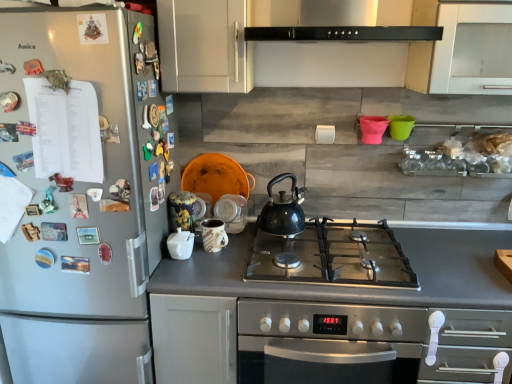
Question: Can you confirm if matte ceramic mug at center, which is counted as the second appliance, starting from the back, is positioned to the left of stainless steel oven at center?

Choices:
 (A) no
 (B) yes

Answer: (B)

Question: Does matte ceramic mug at center, which is counted as the second appliance, starting from the back, have a larger size compared to stainless steel oven at center?

Choices:
 (A) yes
 (B) no

Answer: (B)

Question: Does matte ceramic mug at center, which is counted as the second appliance, starting from the back, appear on the right side of stainless steel oven at center?

Choices:
 (A) yes
 (B) no

Answer: (B)

Question: Does matte ceramic mug at center, which is the 2th appliance from front to back, come behind stainless steel oven at center?

Choices:
 (A) no
 (B) yes

Answer: (B)

Question: Is matte ceramic mug at center, which is the 2th appliance from front to back, smaller than stainless steel oven at center?

Choices:
 (A) yes
 (B) no

Answer: (A)

Question: From a real-world perspective, is black matte kettle at center above or below matte ceramic mug at center, which is the 2th appliance from front to back?

Choices:
 (A) below
 (B) above

Answer: (B)

Question: Would you say black matte kettle at center is inside or outside matte ceramic mug at center, which is counted as the second appliance, starting from the back?

Choices:
 (A) inside
 (B) outside

Answer: (B)

Question: From their relative heights in the image, would you say black matte kettle at center is taller or shorter than matte ceramic mug at center, which is the 2th appliance from front to back?

Choices:
 (A) short
 (B) tall

Answer: (B)

Question: Considering the relative positions of black matte kettle at center and matte ceramic mug at center, which is counted as the second appliance, starting from the back, in the image provided, is black matte kettle at center to the left or to the right of matte ceramic mug at center, which is counted as the second appliance, starting from the back,?

Choices:
 (A) left
 (B) right

Answer: (B)

Question: In the image, is white matte cabinet at upper center positioned in front of or behind matte ceramic mug at center, which is the 2th appliance from front to back?

Choices:
 (A) behind
 (B) front

Answer: (B)

Question: From the image's perspective, is white matte cabinet at upper center positioned above or below matte ceramic mug at center, which is counted as the second appliance, starting from the back?

Choices:
 (A) below
 (B) above

Answer: (B)

Question: In terms of width, does white matte cabinet at upper center look wider or thinner when compared to matte ceramic mug at center, which is the 2th appliance from front to back?

Choices:
 (A) thin
 (B) wide

Answer: (B)

Question: Considering the positions of white matte cabinet at upper center and matte ceramic mug at center, which is counted as the second appliance, starting from the back, in the image, is white matte cabinet at upper center bigger or smaller than matte ceramic mug at center, which is counted as the second appliance, starting from the back,?

Choices:
 (A) small
 (B) big

Answer: (B)

Question: Considering the relative positions of matte ceramic cups at center, the 3th appliance positioned from the front, and white matte cabinet at upper center in the image provided, is matte ceramic cups at center, the 3th appliance positioned from the front, to the left or to the right of white matte cabinet at upper center?

Choices:
 (A) right
 (B) left

Answer: (A)

Question: Is matte ceramic cups at center, the first appliance when ordered from back to front, inside the boundaries of white matte cabinet at upper center, or outside?

Choices:
 (A) outside
 (B) inside

Answer: (A)